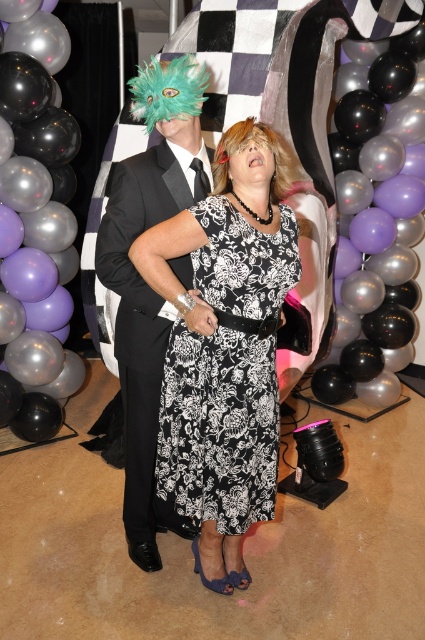
Which is in front, point (350, 109) or point (139, 404)?

Positioned in front is point (139, 404).

The width and height of the screenshot is (425, 640). Identify the location of black glossy balloons at upper center. (377, 218).

Who is more forward, (346, 84) or (122, 228)?

Point (122, 228) is more forward.

Identify the location of black glossy balloons at upper center. (377, 218).

Does black glossy balloons at upper center have a lesser width compared to black glossy balloon at center?

In fact, black glossy balloons at upper center might be wider than black glossy balloon at center.

Between black glossy balloons at upper center and black glossy balloon at center, which one is positioned higher?

black glossy balloons at upper center

This screenshot has width=425, height=640. I want to click on black glossy balloons at upper center, so click(x=377, y=218).

Locate an element on the screen. black glossy balloons at upper center is located at coordinates (377, 218).

How much distance is there between black glossy balloon at center and matte black suit at center?

black glossy balloon at center is 1.12 meters from matte black suit at center.

Is black glossy balloon at center behind matte black suit at center?

That is True.

Is point (2, 177) positioned before point (181, 141)?

No, it is behind (181, 141).

The height and width of the screenshot is (640, 425). I want to click on black glossy balloon at center, so click(x=34, y=230).